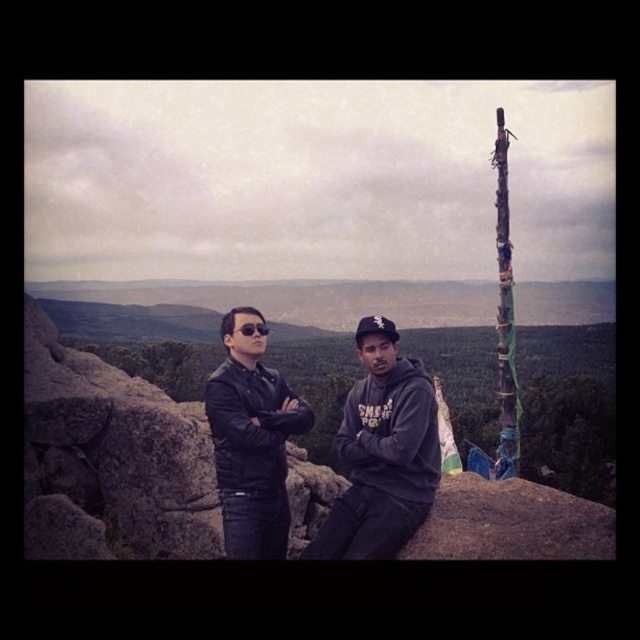
Which of these two, dark gray hoodie at center or leather jacket at center, stands shorter?

Standing shorter between the two is leather jacket at center.

Identify the location of dark gray hoodie at center. (381, 452).

Which is above, leather jacket at center or carved wooden totem pole at right?

carved wooden totem pole at right

Between leather jacket at center and carved wooden totem pole at right, which one is positioned lower?

leather jacket at center

Where is `leather jacket at center`? This screenshot has width=640, height=640. leather jacket at center is located at coordinates (252, 440).

Where is `leather jacket at center`? The image size is (640, 640). leather jacket at center is located at coordinates (252, 440).

Is dark gray hoodie at center wider than carved wooden totem pole at right?

No.

Between dark gray hoodie at center and carved wooden totem pole at right, which one is positioned higher?

carved wooden totem pole at right

Between point (410, 371) and point (509, 268), which one is positioned behind?

Positioned behind is point (509, 268).

Where is `dark gray hoodie at center`? The width and height of the screenshot is (640, 640). dark gray hoodie at center is located at coordinates (381, 452).